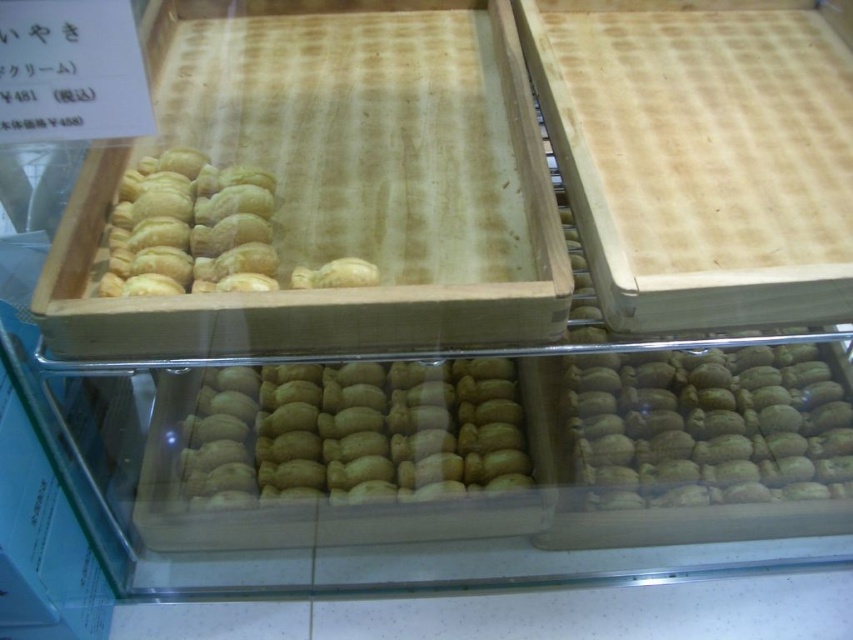
You are a customer at a bakery and want to choose between the golden matte pastry at center and the golden brown doughnut at upper left. Which one is bigger?

The golden matte pastry at center is larger in size compared to the golden brown doughnut at upper left.